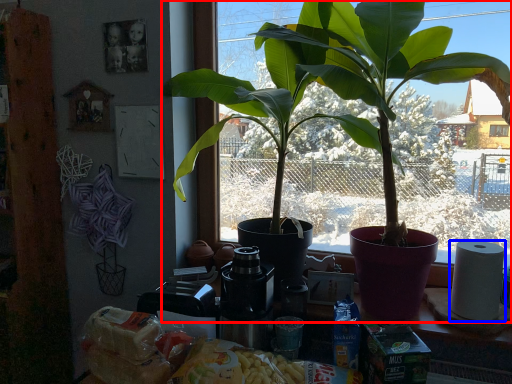
Question: Which point is further to the camera, houseplant (highlighted by a red box) or paper towel (highlighted by a blue box)?

Choices:
 (A) houseplant
 (B) paper towel

Answer: (B)